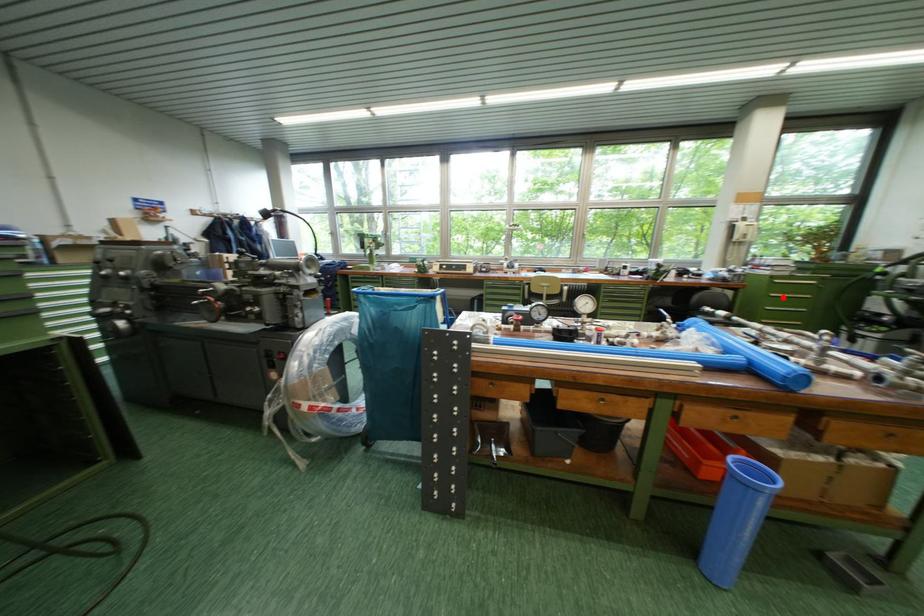
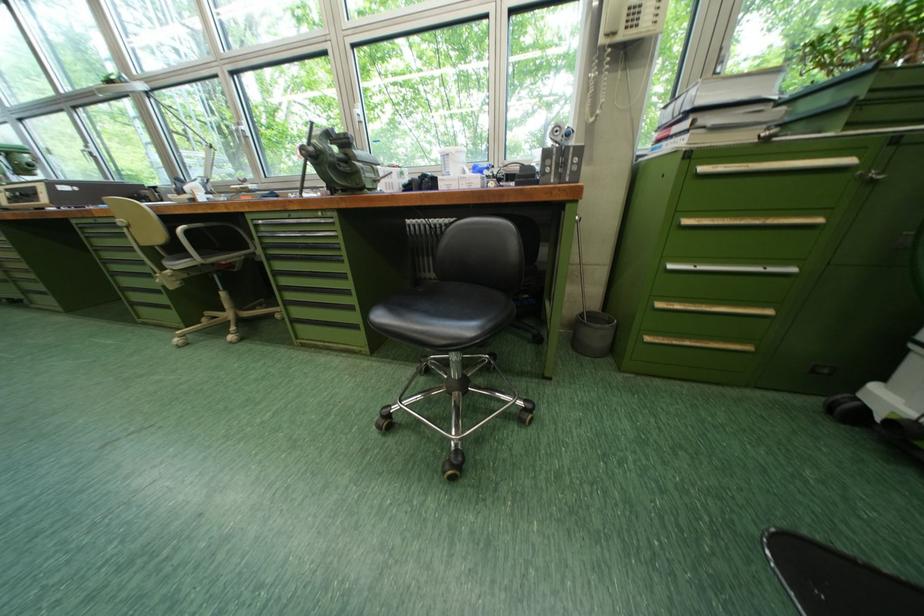
In the second image, find the point that corresponds to the highlighted location in the first image.

(698, 224)